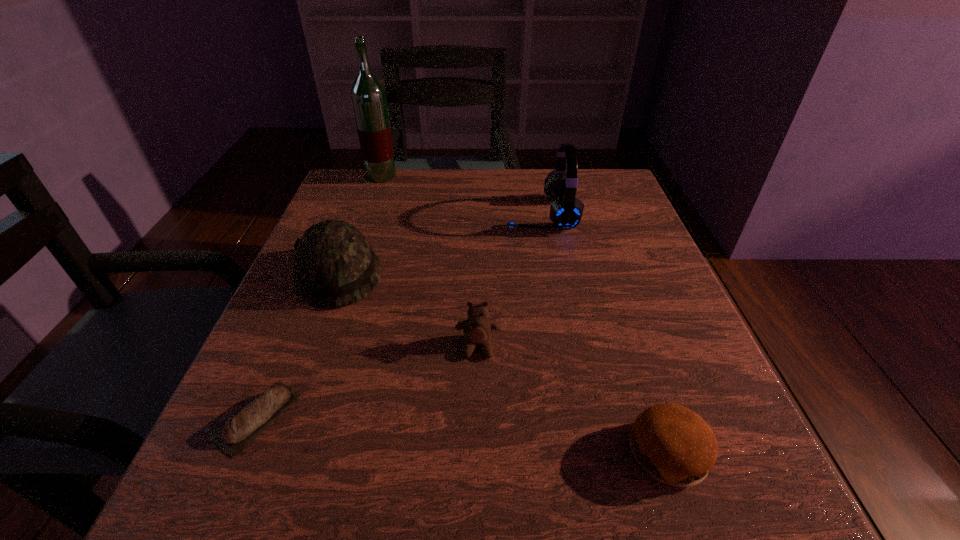
This screenshot has height=540, width=960. I want to click on liquor, so (x=368, y=96).

Where is `the tallest object`? the tallest object is located at coordinates (368, 96).

The image size is (960, 540). Identify the location of the fifth shortest object. (566, 210).

Where is `headset`? The width and height of the screenshot is (960, 540). headset is located at coordinates (566, 210).

Locate an element on the screen. This screenshot has width=960, height=540. the fourth nearest object is located at coordinates (335, 266).

Identify the location of teddy bear. The image size is (960, 540). (477, 329).

The image size is (960, 540). I want to click on the fourth tallest object, so click(477, 329).

Locate an element on the screen. This screenshot has height=540, width=960. hamburger is located at coordinates (672, 443).

Where is `the shortest object`? This screenshot has height=540, width=960. the shortest object is located at coordinates 239,431.

Identify the location of free space located 0.350m on the right of the tallest object. (528, 176).